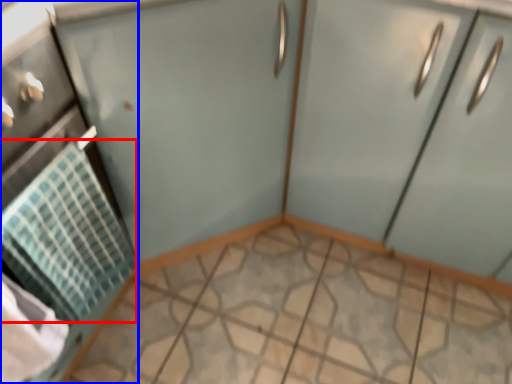
Question: Among these objects, which one is farthest to the camera, blanket (highlighted by a red box) or appliance (highlighted by a blue box)?

Choices:
 (A) blanket
 (B) appliance

Answer: (A)